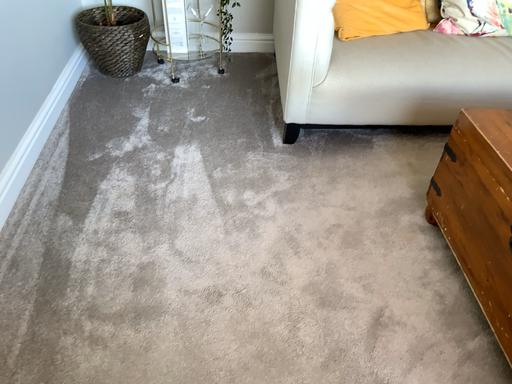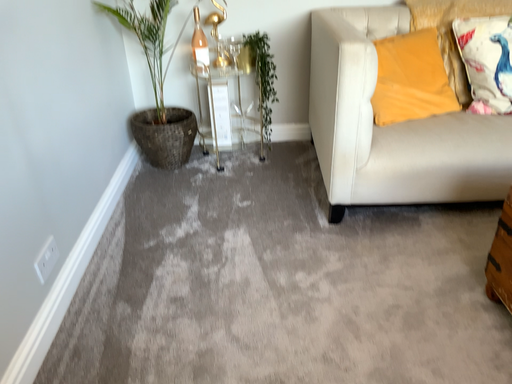
Question: Which way did the camera rotate in the video?

Choices:
 (A) rotated downward
 (B) rotated upward

Answer: (B)